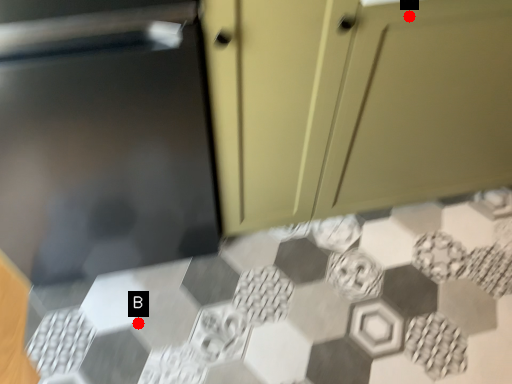
Question: Two points are circled on the image, labeled by A and B beside each circle. Which point is farther from the camera taking this photo?

Choices:
 (A) A is further
 (B) B is further

Answer: (B)